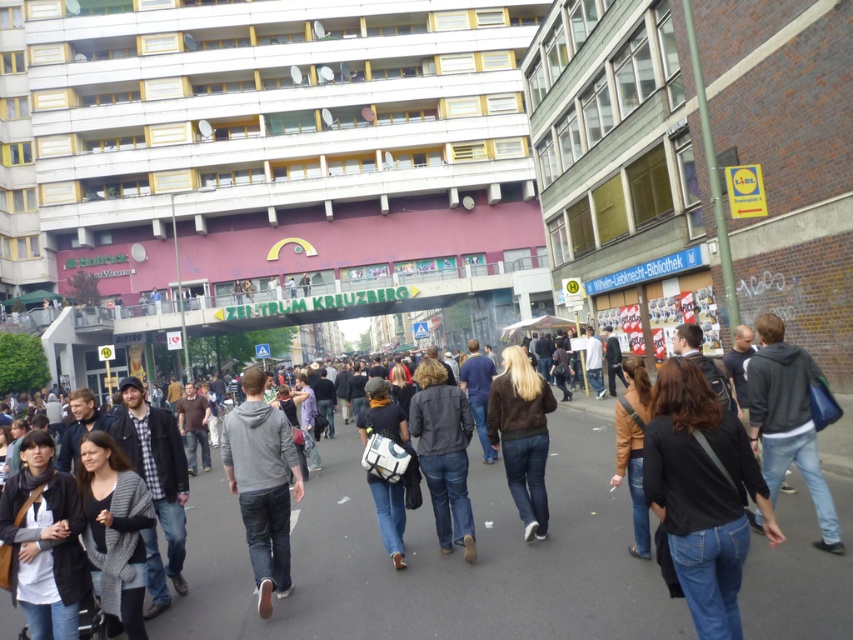
Question: Which object appears closest to the camera in this image?

Choices:
 (A) denim jeans at center
 (B) dark gray hoodie at center
 (C) denim jacket at center
 (D) brown suede jacket at center

Answer: (C)

Question: Considering the real-world distances, which object is closest to the brown suede jacket at center?

Choices:
 (A) dark gray jacket at center
 (B) black denim jeans at center
 (C) gray hoodie at center

Answer: (A)

Question: In this image, where is dark gray jacket at center located relative to brown suede jacket at center?

Choices:
 (A) right
 (B) left

Answer: (B)

Question: Does denim jacket at center come in front of gray knitted sweater at lower left?

Choices:
 (A) no
 (B) yes

Answer: (B)

Question: Estimate the real-world distances between objects in this image. Which object is closer to the brown suede jacket at center?

Choices:
 (A) white cotton shirt at lower left
 (B) gray knitted sweater at lower left
 (C) dark gray jacket at center

Answer: (C)

Question: Does white cotton shirt at lower left lie behind gray knitted sweater at lower left?

Choices:
 (A) no
 (B) yes

Answer: (A)